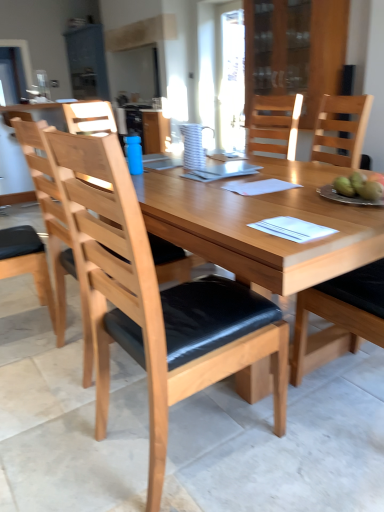
Where is `free space that is to the left of metallic silver plate at right`? This screenshot has width=384, height=512. free space that is to the left of metallic silver plate at right is located at coordinates (298, 200).